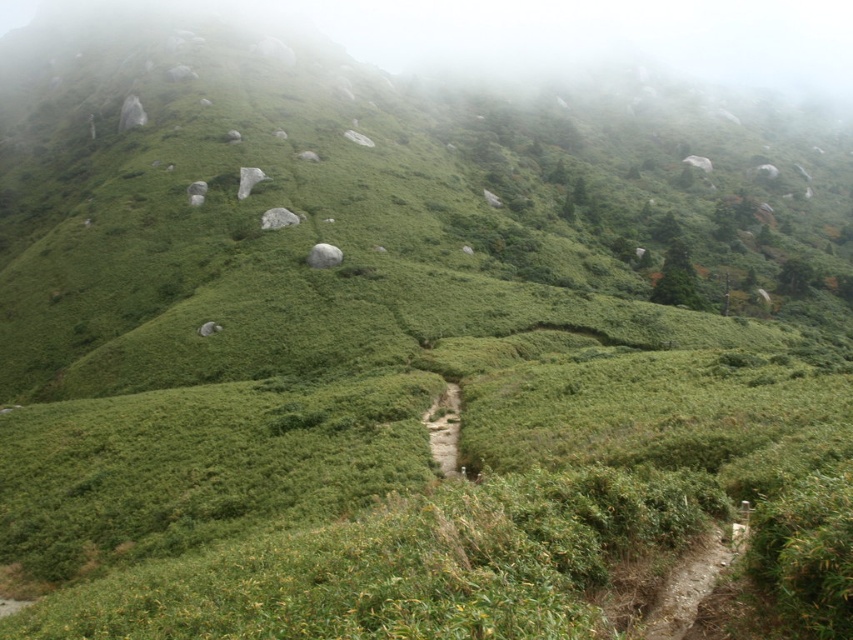
Is green grassy trail at center smaller than green leafy tree at upper center?

Indeed, green grassy trail at center has a smaller size compared to green leafy tree at upper center.

Is green grassy trail at center below green leafy tree at upper center?

Correct, green grassy trail at center is located below green leafy tree at upper center.

Is point (433, 416) positioned behind point (695, 282)?

No, it is not.

I want to click on green grassy trail at center, so click(444, 429).

Which of these two, dirt path at lower right or green leafy tree at upper center, stands taller?

green leafy tree at upper center is taller.

Looking at this image, how much distance is there between dirt path at lower right and green leafy tree at upper center?

They are 93.00 meters apart.

Locate an element on the screen. The image size is (853, 640). dirt path at lower right is located at coordinates (692, 582).

Between dirt path at lower right and green grassy trail at center, which one is positioned lower?

green grassy trail at center is below.

Can you confirm if dirt path at lower right is smaller than green grassy trail at center?

Indeed, dirt path at lower right has a smaller size compared to green grassy trail at center.

In order to click on dirt path at lower right in this screenshot , I will do `click(692, 582)`.

Where is `dirt path at lower right`? This screenshot has height=640, width=853. dirt path at lower right is located at coordinates (692, 582).